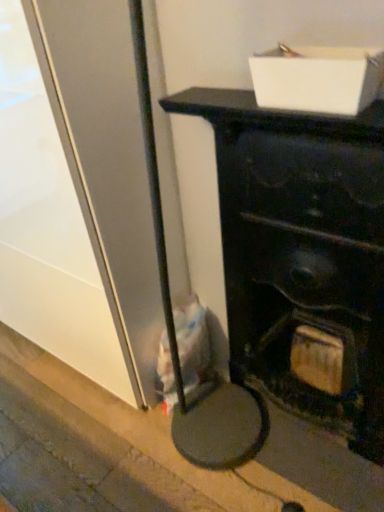
Question: Is concrete at lower left positioned behind white cardboard box at upper center?

Choices:
 (A) yes
 (B) no

Answer: (A)

Question: Is concrete at lower left thinner than white cardboard box at upper center?

Choices:
 (A) no
 (B) yes

Answer: (A)

Question: Considering the relative sizes of concrete at lower left and white cardboard box at upper center in the image provided, is concrete at lower left taller than white cardboard box at upper center?

Choices:
 (A) yes
 (B) no

Answer: (B)

Question: Is concrete at lower left aimed at white cardboard box at upper center?

Choices:
 (A) yes
 (B) no

Answer: (B)

Question: Is concrete at lower left shorter than white cardboard box at upper center?

Choices:
 (A) yes
 (B) no

Answer: (A)

Question: From a real-world perspective, is matte black fireplace at center above or below white cardboard box at upper center?

Choices:
 (A) above
 (B) below

Answer: (B)

Question: In the image, is matte black fireplace at center positioned in front of or behind white cardboard box at upper center?

Choices:
 (A) front
 (B) behind

Answer: (A)

Question: Looking at the image, does matte black fireplace at center seem bigger or smaller compared to white cardboard box at upper center?

Choices:
 (A) big
 (B) small

Answer: (A)

Question: Is matte black fireplace at center wider or thinner than white cardboard box at upper center?

Choices:
 (A) wide
 (B) thin

Answer: (A)

Question: Does point (66, 392) appear closer or farther from the camera than point (279, 64)?

Choices:
 (A) closer
 (B) farther

Answer: (B)

Question: From a real-world perspective, is concrete at lower left physically located above or below white cardboard box at upper center?

Choices:
 (A) above
 (B) below

Answer: (B)

Question: In the image, is concrete at lower left positioned in front of or behind white cardboard box at upper center?

Choices:
 (A) behind
 (B) front

Answer: (A)

Question: Based on their positions, is concrete at lower left located to the left or right of white cardboard box at upper center?

Choices:
 (A) left
 (B) right

Answer: (A)

Question: In terms of size, does matte black fireplace at center appear bigger or smaller than concrete at lower left?

Choices:
 (A) big
 (B) small

Answer: (A)

Question: Is point (375, 331) positioned closer to the camera than point (29, 365)?

Choices:
 (A) farther
 (B) closer

Answer: (B)